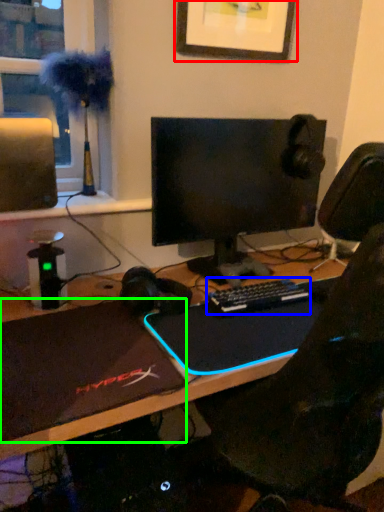
Question: Which object is positioned farthest from picture frame (highlighted by a red box)? Select from computer keyboard (highlighted by a blue box) and laptop (highlighted by a green box).

Choices:
 (A) computer keyboard
 (B) laptop

Answer: (B)